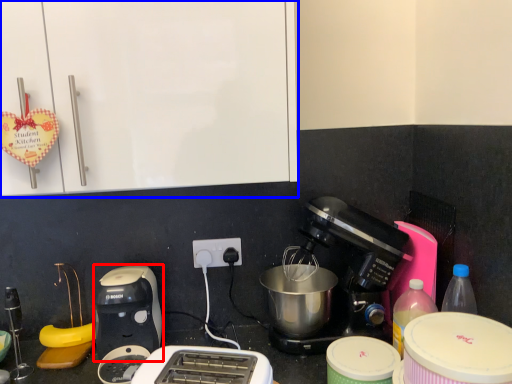
Question: Which object appears closest to the camera in this image, toaster (highlighted by a red box) or cabinetry (highlighted by a blue box)?

Choices:
 (A) toaster
 (B) cabinetry

Answer: (B)